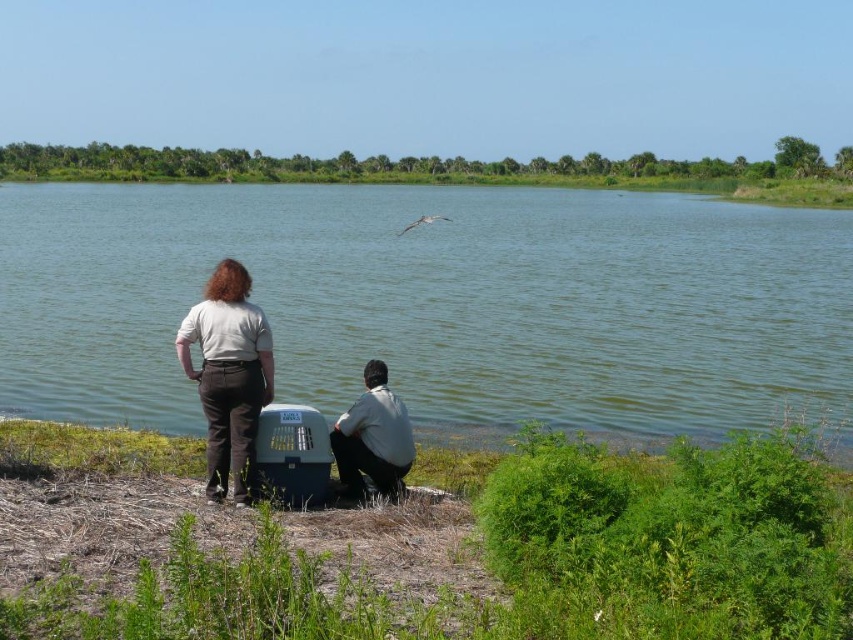
You are a photographer trying to capture a photo of the green water at center without the light gray cotton shirt at center appearing in the frame. Based on their positions, is this possible?

The green water at center is above the light gray cotton shirt at center, so by adjusting the camera angle to focus on the upper part of the scene where the green water at center is located, it is possible to exclude the light gray cotton shirt at center from the frame.

You are standing in the scene and want to place a 1.2 meter wide picnic blanket between the green water at center and the light gray cotton shirt at center. Will the blanket fit horizontally between them?

The green water at center is wider than the light gray cotton shirt at center. However, the question is about placing a picnic blanket between them horizontally. Since the description only provides information about their widths relative to each other, not the actual distance between them, we cannot determine if the 1.2 meter blanket will fit. Additional spatial details about the separation between the two objects are needed to answer this accurately.

You are standing near the two people in the scene. The person in the light gray shirt at lower center is sitting on the ground. Where is the green water at center located relative to them?

The green water at center is to the left of the light gray shirt at lower center.